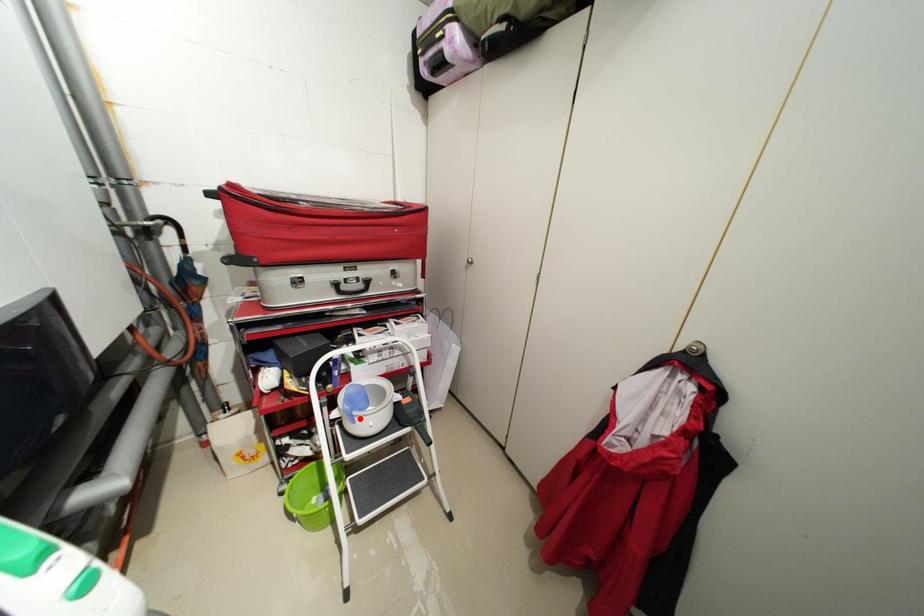
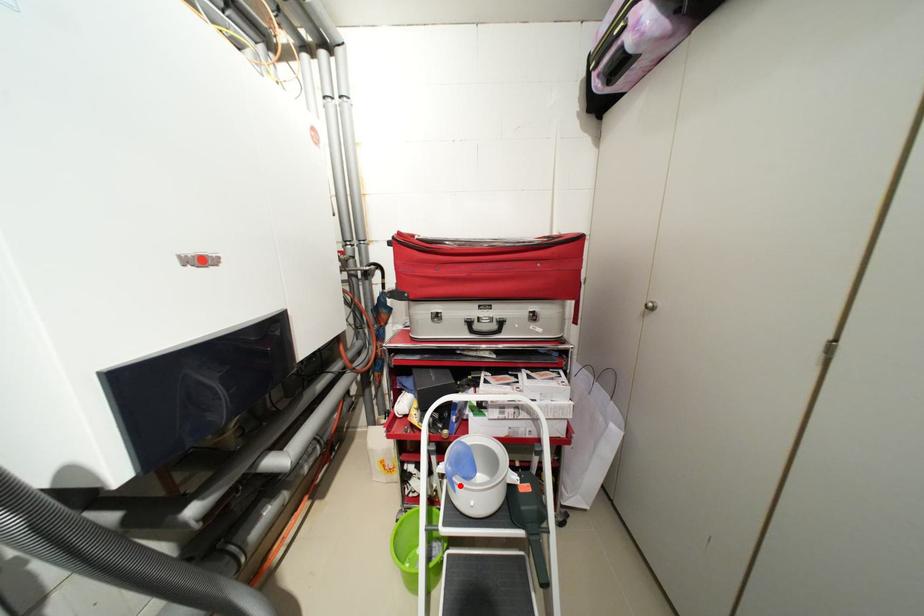
Looking at this image, I am providing you with two images of the same scene from different viewpoints. A red point is marked on the first image and another point is marked on the second image. Is the marked point in image1 the same physical position as the marked point in image2?

Yes